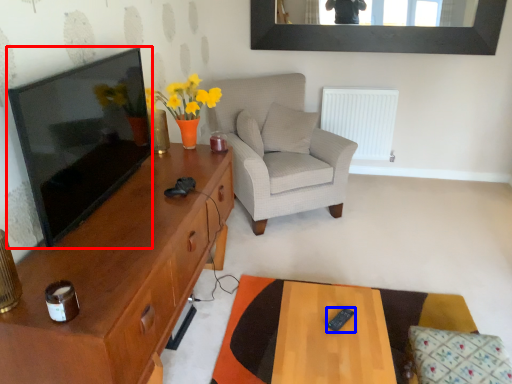
Question: Which object appears farthest to the camera in this image, television (highlighted by a red box) or remote control (highlighted by a blue box)?

Choices:
 (A) television
 (B) remote control

Answer: (B)